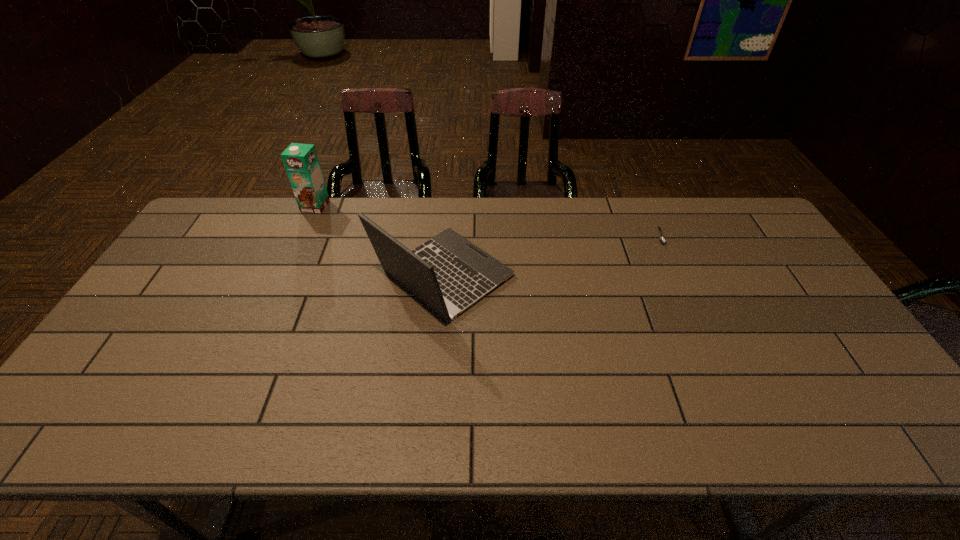
Where is `free space that satisfies the following two spatial constraints: 1. on the front side of the shortest object; 2. at the front screen of the second object from right to left`? Image resolution: width=960 pixels, height=540 pixels. free space that satisfies the following two spatial constraints: 1. on the front side of the shortest object; 2. at the front screen of the second object from right to left is located at coordinates (678, 276).

You are a GUI agent. You are given a task and a screenshot of the screen. Output one action in this format:
    pyautogui.click(x=<x>, y=<y>)
    Task: Click on the vacant area that satisfies the following two spatial constraints: 1. on the front side of the soupspoon; 2. at the front screen of the laptop_computer
    The width and height of the screenshot is (960, 540).
    Given the screenshot: What is the action you would take?
    pyautogui.click(x=678, y=276)